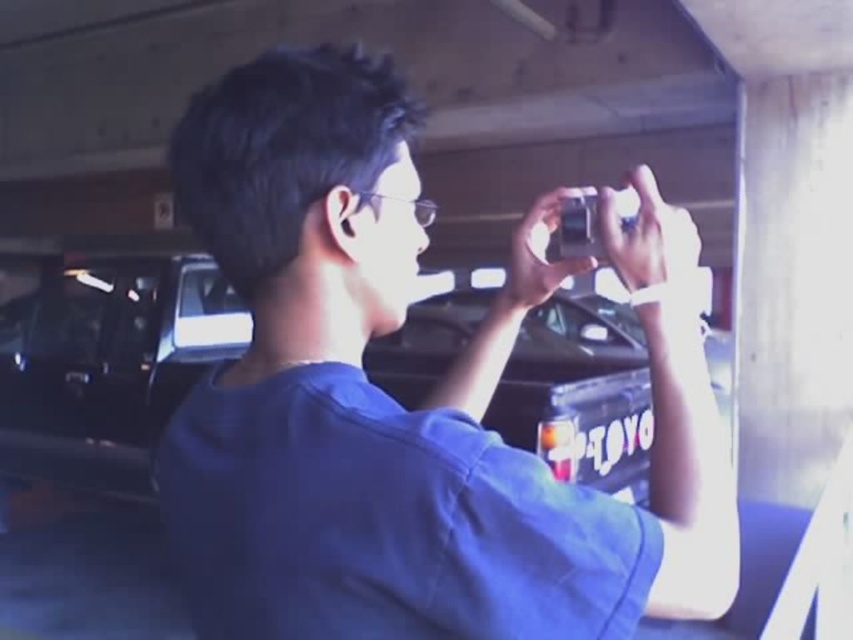
You are a photographer trying to position yourself so that the blue fabric shirt at center and the glossy black truck at center are both visible in your frame. Based on their positions, which object should be placed on the left side of your camera view?

The glossy black truck at center should be placed on the left side of your camera view because the blue fabric shirt at center is to the right of the glossy black truck at center.

You are a photographer trying to capture a clear image of the glossy black truck at center while the blue fabric shirt at center is blocking the view. Can you suggest a way to move the shirt to get a clear shot of the truck?

The blue fabric shirt at center is smaller than the glossy black truck at center, so moving the shirt to the side would allow the truck to be fully visible in the photograph.

In the scene shown: You are a photographer trying to capture a clear photo of the glossy black truck at center. However, the blue fabric shirt at center is blocking your view. Can you move around to the left side to get a better shot without the obstruction?

The blue fabric shirt at center is in front of the glossy black truck at center, so moving to the left side might allow you to see around the shirt and capture the truck without obstruction.